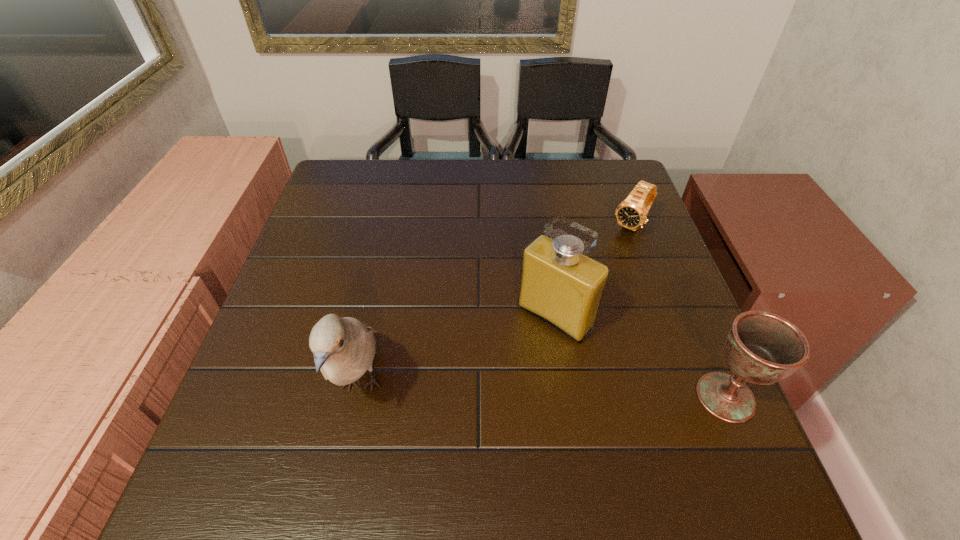
This screenshot has height=540, width=960. I want to click on vacant space on the desktop that is between the bird and the chalice and is positioned on the face of the shortest object, so click(493, 389).

Identify the location of vacant space on the desktop that is between the leftmost object and the chalice and is positioned on the front-facing side of the perfume. Image resolution: width=960 pixels, height=540 pixels. (489, 389).